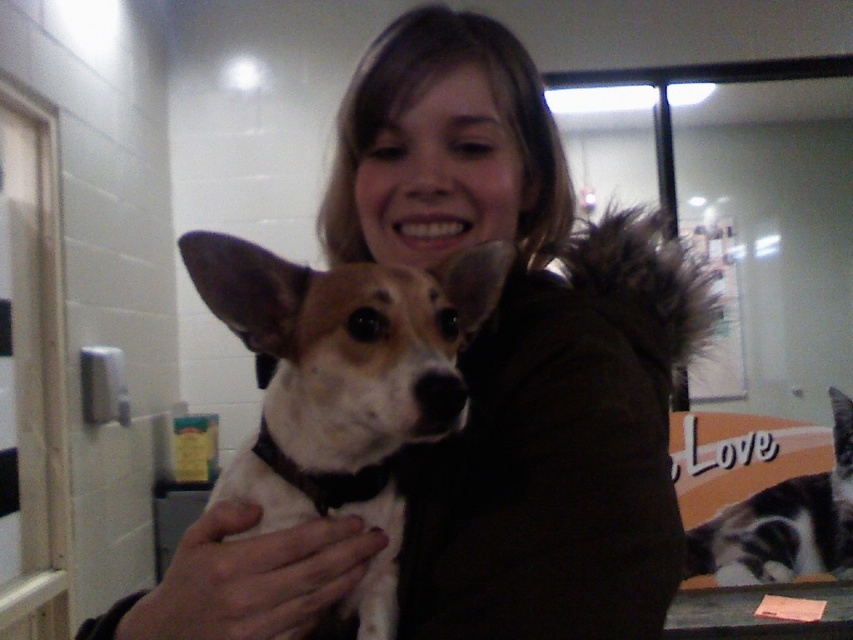
You are a photographer trying to capture a clear photo of the white fur dog at center and the gray and white fur cat at lower right. Since you want both subjects to be in focus, which one should you focus on first?

The white fur dog at center is in front of the gray and white fur cat at lower right, so you should focus on the white fur dog at center first to ensure both are in focus.

You are a cleaning robot with a width of 2 feet. You need to move from the white fur dog at center to the gray and white fur cat at lower right. Can you pass through the space between them without touching either?

The distance between the white fur dog at center and the gray and white fur cat at lower right is 6.46 feet. Since the robot is 2 feet wide, there is enough space for it to pass through without touching either.

You are standing in a veterinary clinic and see a point marked at coordinates (283, 509). If you want to reach this point with a 24 inch long measuring tape, will you be able to do so?

The point at (283, 509) is 25.22 inches away from the viewer. Since the measuring tape is only 24 inches long, it will not be long enough to reach that point.